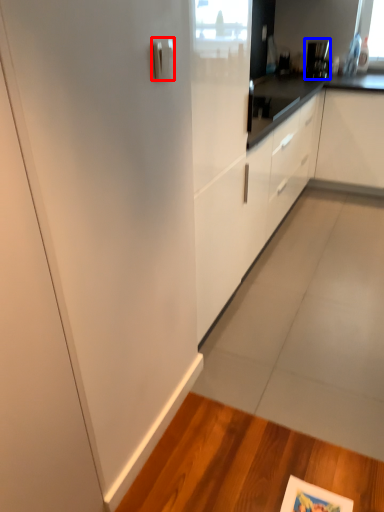
Question: Which of the following is the farthest to the observer, door handle (highlighted by a red box) or appliance (highlighted by a blue box)?

Choices:
 (A) door handle
 (B) appliance

Answer: (B)